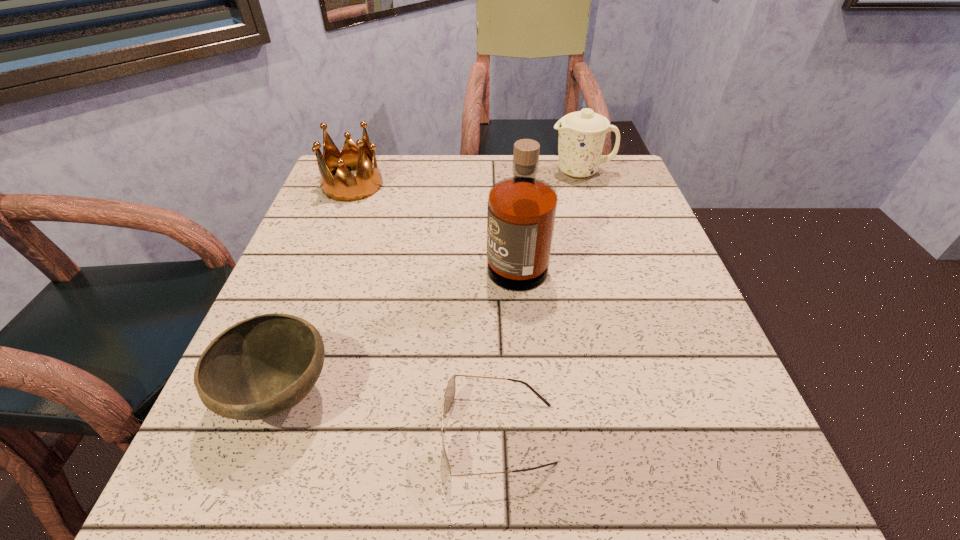
What are the coordinates of `free space at the near left corner of the desktop` in the screenshot? It's located at (262, 512).

The image size is (960, 540). I want to click on unoccupied position between the sunglasses and the chinaware, so click(x=540, y=303).

Where is `free space between the crown and the shortest object`? free space between the crown and the shortest object is located at coordinates (425, 309).

This screenshot has height=540, width=960. What are the coordinates of `vacant area that lies between the crown and the fourth tallest object` in the screenshot? It's located at (317, 290).

Locate an element on the screen. This screenshot has width=960, height=540. vacant area that lies between the crown and the chinaware is located at coordinates (467, 178).

At what (x,y) coordinates should I click in order to perform the action: click on empty location between the fourth tallest object and the tallest object. Please return your answer as a coordinate pair (x, y). Looking at the image, I should click on (398, 325).

Identify the location of free space that is in between the shortest object and the crown. Image resolution: width=960 pixels, height=540 pixels. (425, 309).

This screenshot has height=540, width=960. I want to click on blank region between the sunglasses and the liquor, so click(x=507, y=345).

This screenshot has height=540, width=960. Identify the location of free spot between the chinaware and the crown. (467, 178).

At what (x,y) coordinates should I click in order to perform the action: click on the second closest object to the fourth tallest object. Please return your answer as a coordinate pair (x, y). Looking at the image, I should click on [x=521, y=212].